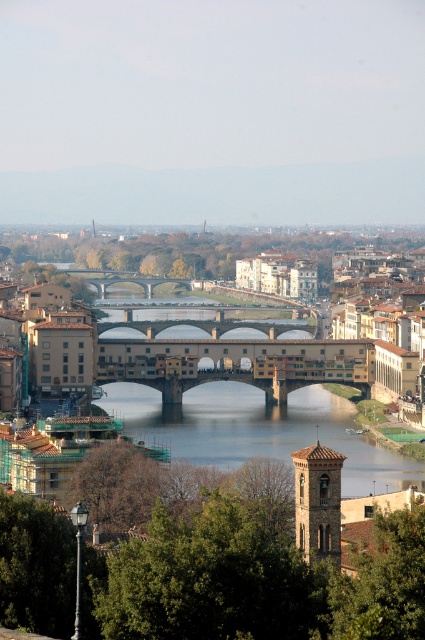
Question: Is clear water at bridge center to the left of stone arch bridge at center from the viewer's perspective?

Choices:
 (A) no
 (B) yes

Answer: (A)

Question: Can you confirm if clear water at bridge center is positioned to the left of stone arch bridge at center?

Choices:
 (A) no
 (B) yes

Answer: (A)

Question: Considering the relative positions of clear water at bridge center and brown stone bridge at center in the image provided, where is clear water at bridge center located with respect to brown stone bridge at center?

Choices:
 (A) left
 (B) right

Answer: (A)

Question: Which point appears closest to the camera in this image?

Choices:
 (A) (90, 282)
 (B) (278, 413)

Answer: (B)

Question: Which is nearer to the clear water at bridge center?

Choices:
 (A) stone arch bridge at center
 (B) brown stone bridge at center

Answer: (B)

Question: Which object is positioned farthest from the brown stone bridge at center?

Choices:
 (A) stone arch bridge at center
 (B) clear water at bridge center

Answer: (A)